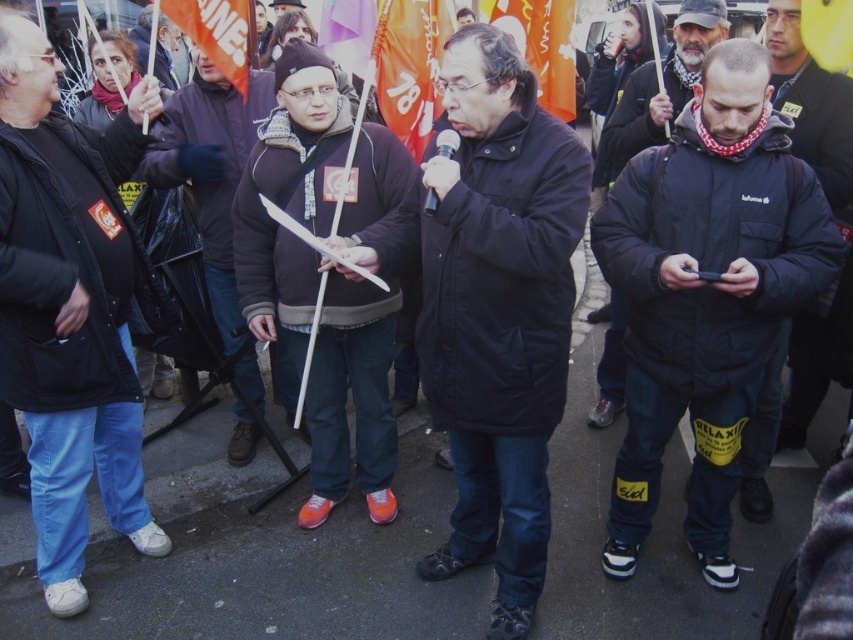
Question: Which point is closer to the camera?

Choices:
 (A) (596, 419)
 (B) (97, 262)
 (C) (231, 52)
 (D) (427, 136)

Answer: (B)

Question: Which object is closer to the camera taking this photo?

Choices:
 (A) dark blue puffy jacket at center
 (B) orange fabric flag at upper center
 (C) matte black coat at center
 (D) matte black jacket at left

Answer: (C)

Question: Can you confirm if matte black coat at center is wider than orange fabric flag at upper center?

Choices:
 (A) yes
 (B) no

Answer: (A)

Question: Can you confirm if matte black coat at center is smaller than dark blue puffer jacket at center?

Choices:
 (A) no
 (B) yes

Answer: (A)

Question: Which of these objects is positioned closest to the orange fabric flag at upper left?

Choices:
 (A) black matte jacket at lower right
 (B) dark blue puffer jacket at center

Answer: (A)

Question: Is matte black coat at center bigger than black matte jacket at lower right?

Choices:
 (A) yes
 (B) no

Answer: (A)